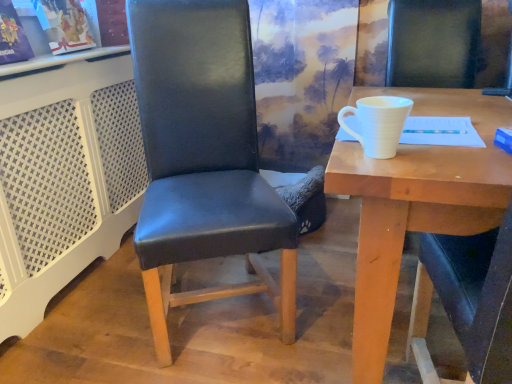
Locate an element on the screen. vacant space situated on the left part of black leather chair at center is located at coordinates (103, 321).